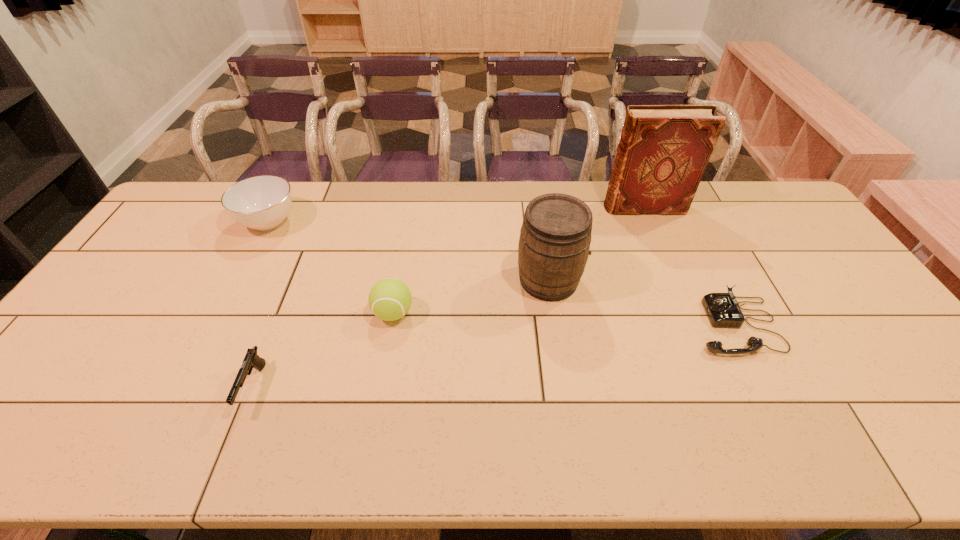
Identify the location of vacant space located 0.290m on the spine side of the tallest object. (521, 207).

Image resolution: width=960 pixels, height=540 pixels. I want to click on vacant position located 0.170m on the front of the wine bucket, so click(x=561, y=356).

Identify the location of vacant area located 0.330m on the front of the chinaware. (215, 324).

Locate an element on the screen. vacant space located on the right of the third object from left to right is located at coordinates (548, 313).

Identify the location of free space located 0.120m on the dial of the telephone. (648, 326).

Locate an element on the screen. Image resolution: width=960 pixels, height=540 pixels. vacant point located on the dial of the telephone is located at coordinates (x=660, y=326).

This screenshot has height=540, width=960. Identify the location of vacant space located 0.230m on the dial of the telephone. (608, 326).

Where is `blank area located 0.060m at the aiming end of the second object from left to right`? The height and width of the screenshot is (540, 960). blank area located 0.060m at the aiming end of the second object from left to right is located at coordinates (230, 443).

The image size is (960, 540). I want to click on hardback book at the far edge, so click(x=663, y=151).

Image resolution: width=960 pixels, height=540 pixels. In order to click on chinaware located at the far edge in this screenshot , I will do `click(263, 202)`.